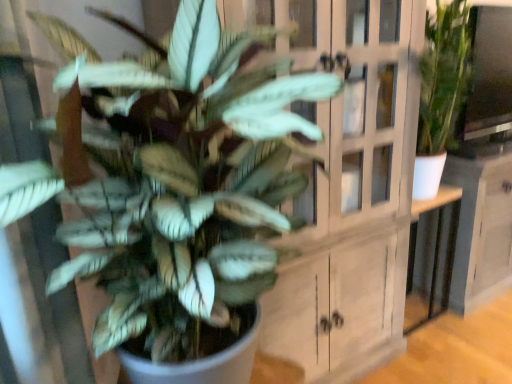
Question: Can you confirm if white wood cabinet at center is bigger than white glossy table at center?

Choices:
 (A) yes
 (B) no

Answer: (A)

Question: Is white wood cabinet at center behind white glossy table at center?

Choices:
 (A) no
 (B) yes

Answer: (A)

Question: Does white wood cabinet at center have a lesser width compared to white glossy table at center?

Choices:
 (A) no
 (B) yes

Answer: (A)

Question: Is white wood cabinet at center taller than white glossy table at center?

Choices:
 (A) yes
 (B) no

Answer: (A)

Question: Would you say white wood cabinet at center contains white glossy table at center?

Choices:
 (A) no
 (B) yes

Answer: (A)

Question: Considering the positions of white glossy table at center and white wood cabinet at center in the image, is white glossy table at center wider or thinner than white wood cabinet at center?

Choices:
 (A) wide
 (B) thin

Answer: (B)

Question: Choose the correct answer: Is white glossy table at center inside white wood cabinet at center or outside it?

Choices:
 (A) inside
 (B) outside

Answer: (B)

Question: From a real-world perspective, is white glossy table at center physically located above or below white wood cabinet at center?

Choices:
 (A) below
 (B) above

Answer: (A)

Question: Considering the positions of white glossy table at center and white wood cabinet at center in the image, is white glossy table at center taller or shorter than white wood cabinet at center?

Choices:
 (A) tall
 (B) short

Answer: (B)

Question: From the image's perspective, is green matte plant at center above or below white wood cabinet at center?

Choices:
 (A) below
 (B) above

Answer: (A)

Question: Considering the positions of green matte plant at center and white wood cabinet at center in the image, is green matte plant at center wider or thinner than white wood cabinet at center?

Choices:
 (A) thin
 (B) wide

Answer: (B)

Question: Does point (117, 130) appear closer or farther from the camera than point (354, 248)?

Choices:
 (A) closer
 (B) farther

Answer: (A)

Question: From their relative heights in the image, would you say green matte plant at center is taller or shorter than white wood cabinet at center?

Choices:
 (A) short
 (B) tall

Answer: (A)

Question: Is white glossy table at center inside or outside of green matte plant at center?

Choices:
 (A) outside
 (B) inside

Answer: (A)

Question: From a real-world perspective, relative to green matte plant at center, is white glossy table at center vertically above or below?

Choices:
 (A) below
 (B) above

Answer: (A)